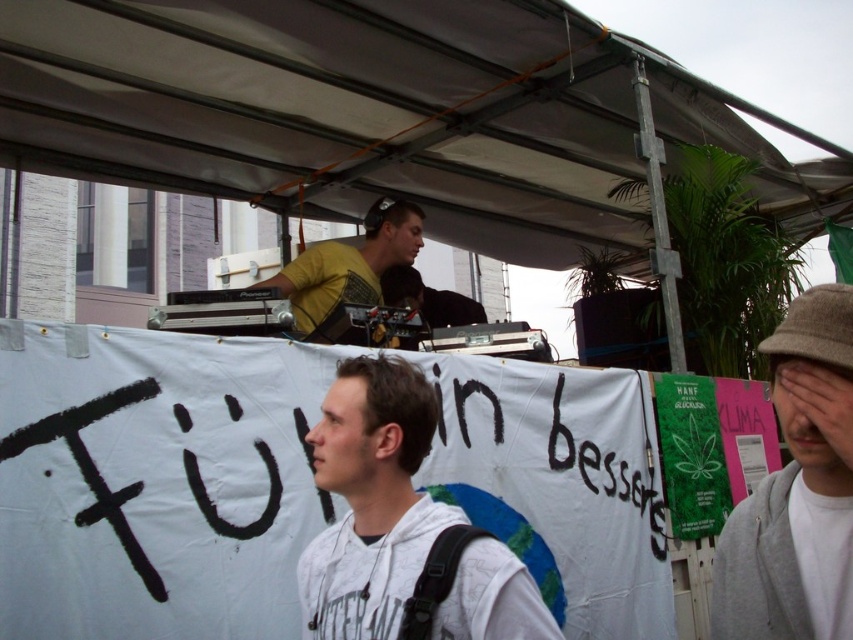
Who is shorter, gray woolen hat at lower right or yellow matte shirt at upper center?

yellow matte shirt at upper center is shorter.

Measure the distance between point (769,545) and camera.

A distance of 5.32 feet exists between point (769,545) and camera.

What are the coordinates of `gray woolen hat at lower right` in the screenshot? It's located at (798, 490).

Which is in front, point (366, 438) or point (798, 320)?

Point (798, 320) is more forward.

Who is higher up, white hoodie at center or gray woolen hat at lower right?

gray woolen hat at lower right

Does point (503, 614) come farther from viewer compared to point (792, 404)?

Yes, point (503, 614) is farther from viewer.

What are the coordinates of `white hoodie at center` in the screenshot? It's located at (370, 500).

At what (x,y) coordinates should I click in order to perform the action: click on white hoodie at center. Please return your answer as a coordinate pair (x, y). Looking at the image, I should click on (370, 500).

Between point (384, 406) and point (323, 307), which one is positioned in front?

Point (384, 406) is in front.

Locate an element on the screen. This screenshot has width=853, height=640. white hoodie at center is located at coordinates (370, 500).